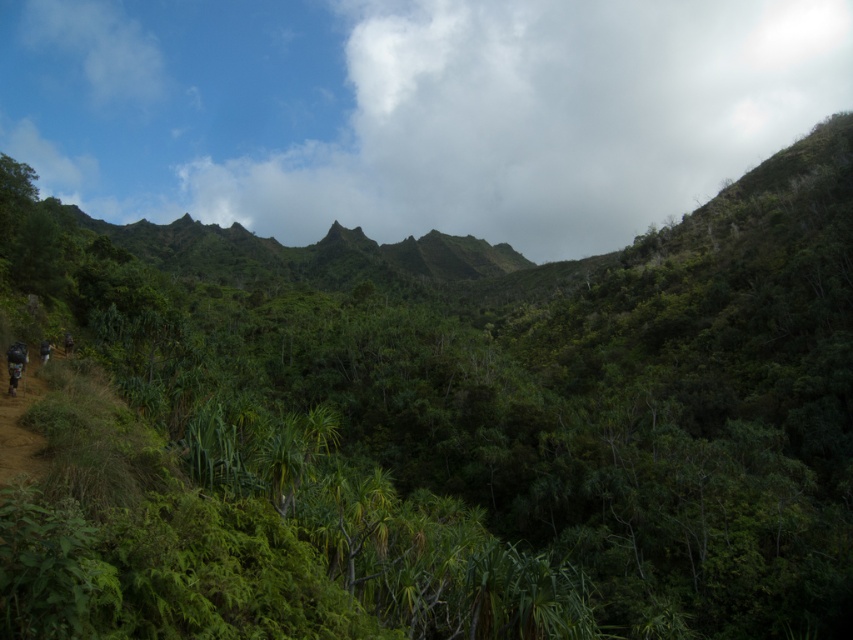
What is the exact coordinate of the cloudy sky at upper center in the image?

The cloudy sky at upper center is located at point (538, 120).

You are planning to take a photo of the cloudy sky at upper center and the camouflage fabric mountain biker at lower left. Which object is higher in the image?

The cloudy sky at upper center is taller than the camouflage fabric mountain biker at lower left.

You are a hiker trying to navigate through the dense vegetation in the image. You see the cloudy sky at upper center and the camouflage fabric mountain biker at lower left. Which object is closer to you?

The camouflage fabric mountain biker at lower left is behind the cloudy sky at upper center, so the cloudy sky at upper center is closer to you.